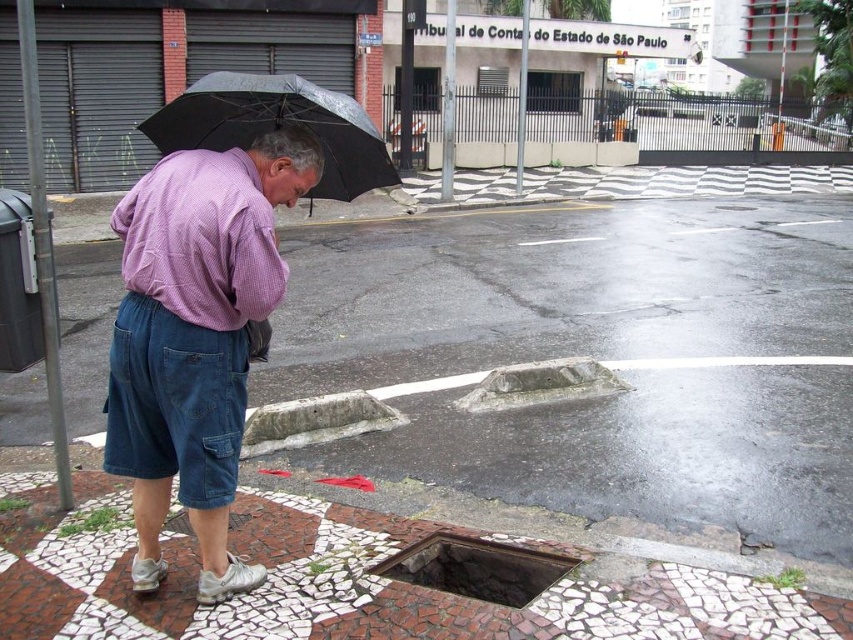
Question: Which is nearer to the white mosaic pavement at lower center?

Choices:
 (A) black matte umbrella at upper left
 (B) purple woven shirt at center
 (C) rusty metal manhole at lower center

Answer: (C)

Question: Which point is closer to the camera?

Choices:
 (A) purple woven shirt at center
 (B) rusty metal manhole at lower center
 (C) black matte umbrella at upper left

Answer: (A)

Question: Can you confirm if white mosaic pavement at lower center is positioned to the right of black matte umbrella at upper left?

Choices:
 (A) no
 (B) yes

Answer: (B)

Question: Does white mosaic pavement at lower center have a lesser width compared to rusty metal manhole at lower center?

Choices:
 (A) yes
 (B) no

Answer: (B)

Question: Which point is closer to the camera?

Choices:
 (A) black matte umbrella at upper left
 (B) purple woven shirt at center

Answer: (B)

Question: Is white mosaic pavement at lower center closer to camera compared to purple woven shirt at center?

Choices:
 (A) yes
 (B) no

Answer: (B)